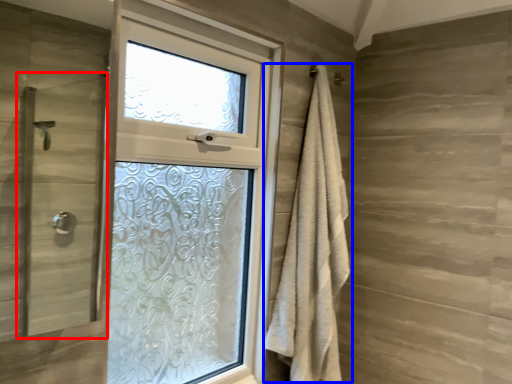
Question: Among these objects, which one is farthest to the camera, screen door (highlighted by a red box) or bath towel (highlighted by a blue box)?

Choices:
 (A) screen door
 (B) bath towel

Answer: (B)